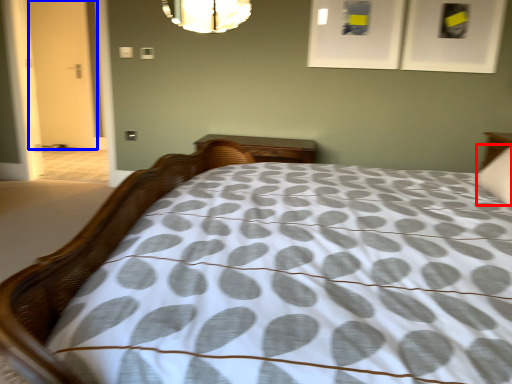
Question: Which object appears farthest to the camera in this image, pillow (highlighted by a red box) or door (highlighted by a blue box)?

Choices:
 (A) pillow
 (B) door

Answer: (B)